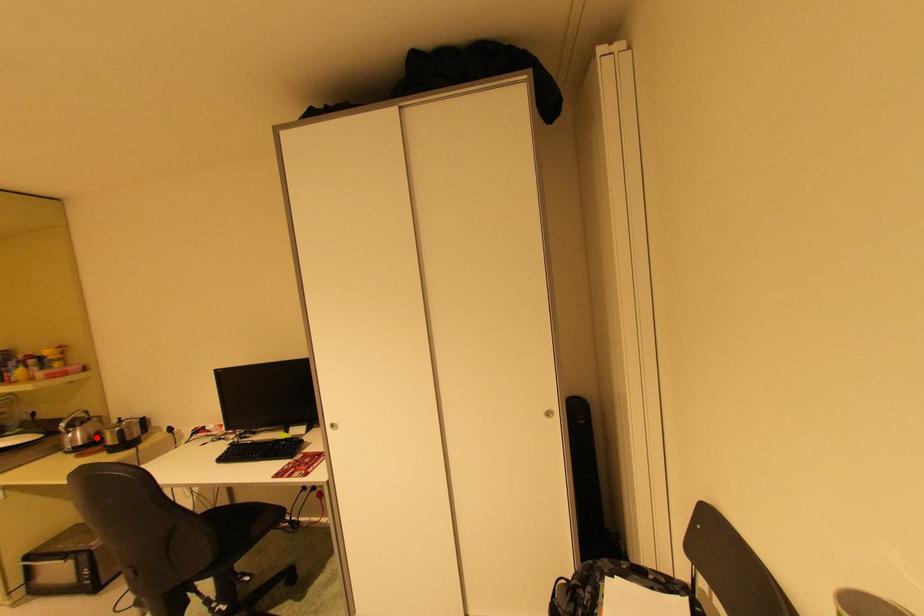
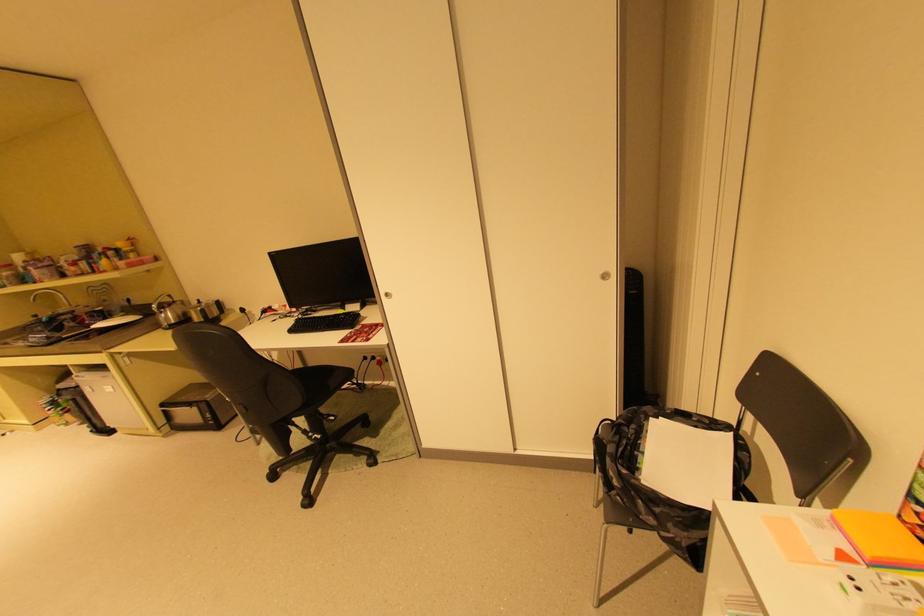
In the second image, find the point that corresponds to the highlighted location in the first image.

(187, 317)